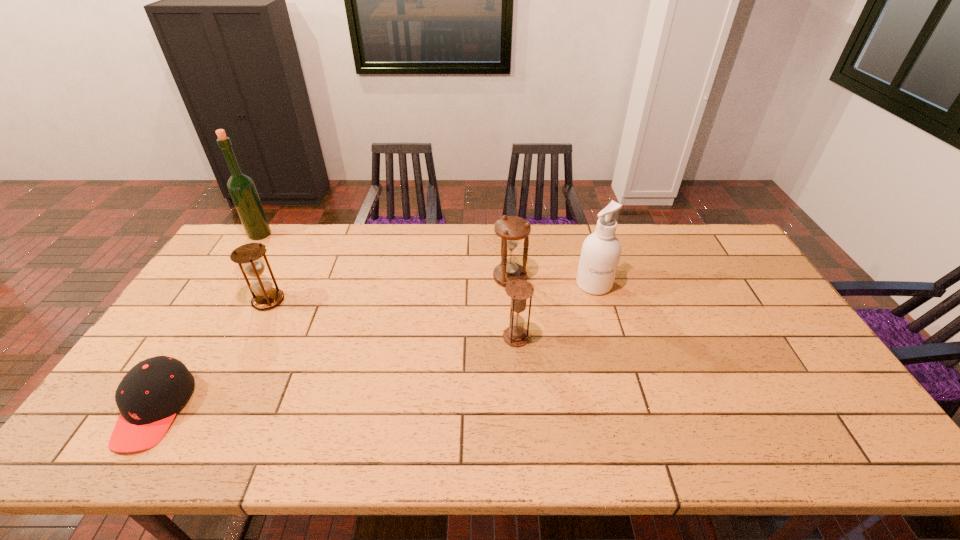
Find the location of a particular element. This screenshot has width=960, height=540. vacant region between the second nearest hourglass and the fifth shortest object is located at coordinates (431, 292).

Identify the location of unoccupied area between the farthest object and the rightmost object. Image resolution: width=960 pixels, height=540 pixels. (427, 259).

Identify the location of free space between the rightmost object and the fifth farthest object. (x=555, y=310).

You are a GUI agent. You are given a task and a screenshot of the screen. Output one action in this format:
    pyautogui.click(x=<x>, y=<y>)
    Task: Click on the free space between the nearest hourglass and the shortest object
    
    Given the screenshot: What is the action you would take?
    pyautogui.click(x=335, y=374)

Identify which object is the third nearest to the second farthest hourglass. Please provide its 2D coordinates. Your answer should be formatted as a tuple, i.e. [(x, y)], where the tuple contains the x and y coordinates of a point satisfying the conditions above.

[(512, 229)]

Identify which object is located as the fifth nearest to the farthest object. Please provide its 2D coordinates. Your answer should be formatted as a tuple, i.e. [(x, y)], where the tuple contains the x and y coordinates of a point satisfying the conditions above.

[(600, 254)]

The image size is (960, 540). What are the coordinates of `hourglass that is the third closest one to the second tallest object` in the screenshot? It's located at (248, 256).

You are a GUI agent. You are given a task and a screenshot of the screen. Output one action in this format:
    pyautogui.click(x=<x>, y=<y>)
    Task: Click on the closest hourglass to the fourth object from right to left
    
    Given the screenshot: What is the action you would take?
    pyautogui.click(x=512, y=229)

Where is `vacant space that satisfies the following two spatial constraints: 1. on the front side of the second nearest object; 2. on the right side of the third object from left to right`? vacant space that satisfies the following two spatial constraints: 1. on the front side of the second nearest object; 2. on the right side of the third object from left to right is located at coordinates (250, 337).